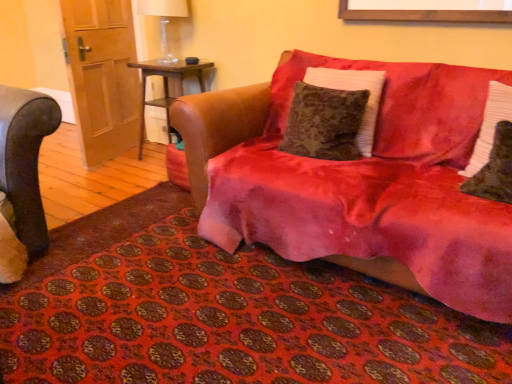
Question: Is velvet black pillow at right, which appears as the second pillow when viewed from the right, next to wooden side table at center and touching it?

Choices:
 (A) no
 (B) yes

Answer: (A)

Question: Would you say velvet black pillow at right, which appears as the second pillow when viewed from the right, contains wooden side table at center?

Choices:
 (A) no
 (B) yes

Answer: (A)

Question: From the image's perspective, is velvet black pillow at right, which is the 2th pillow in left-to-right order, below wooden side table at center?

Choices:
 (A) no
 (B) yes

Answer: (B)

Question: Is velvet black pillow at right, which appears as the second pillow when viewed from the right, looking in the opposite direction of wooden side table at center?

Choices:
 (A) yes
 (B) no

Answer: (B)

Question: From a real-world perspective, is velvet black pillow at right, which appears as the second pillow when viewed from the right, below wooden side table at center?

Choices:
 (A) no
 (B) yes

Answer: (A)

Question: From a real-world perspective, is velvet black pillow at right, which is the 2th pillow in left-to-right order, on wooden side table at center?

Choices:
 (A) no
 (B) yes

Answer: (B)

Question: Is velvet black pillow at right, which appears as the second pillow when viewed from the right, shorter than velvet red couch at center?

Choices:
 (A) yes
 (B) no

Answer: (A)

Question: Is velvet black pillow at right, which is the 2th pillow in left-to-right order, taller than velvet red couch at center?

Choices:
 (A) no
 (B) yes

Answer: (A)

Question: From the image's perspective, would you say velvet black pillow at right, which appears as the second pillow when viewed from the right, is positioned over velvet red couch at center?

Choices:
 (A) no
 (B) yes

Answer: (A)

Question: Does velvet black pillow at right, which appears as the second pillow when viewed from the right, have a smaller size compared to velvet red couch at center?

Choices:
 (A) yes
 (B) no

Answer: (A)

Question: Would you consider velvet black pillow at right, which appears as the second pillow when viewed from the right, to be distant from velvet red couch at center?

Choices:
 (A) yes
 (B) no

Answer: (B)

Question: Is velvet black pillow at right, which is the 2th pillow in left-to-right order, wider than velvet red couch at center?

Choices:
 (A) no
 (B) yes

Answer: (A)

Question: Can you confirm if velvet red couch at center is taller than white textured pillow at right, which ranks as the third pillow in left-to-right order?

Choices:
 (A) no
 (B) yes

Answer: (B)